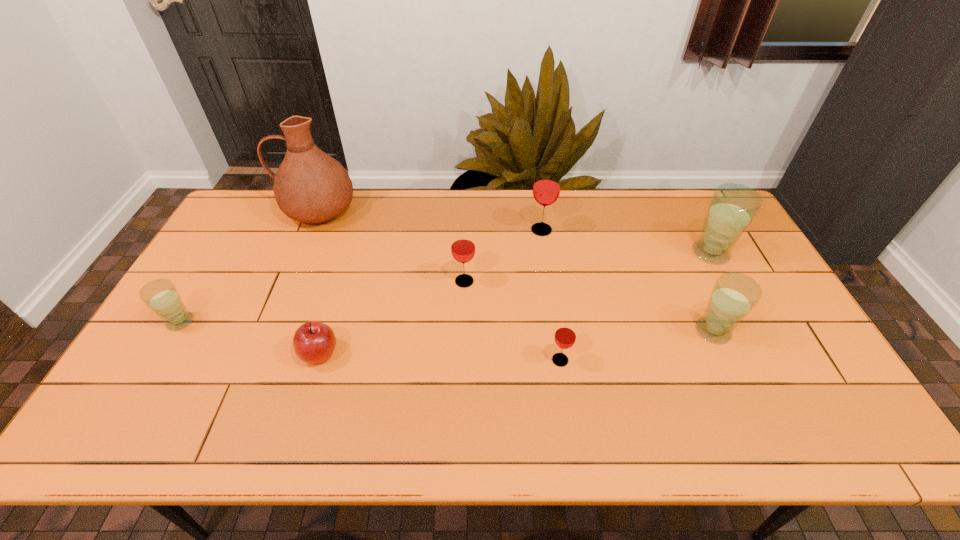
This screenshot has width=960, height=540. What are the coordinates of `empty space between the biggest red glass and the pitcher` in the screenshot? It's located at (430, 220).

The image size is (960, 540). Identify the location of vacant point located between the third farthest glass and the farthest glass. (503, 256).

Locate an element on the screen. This screenshot has width=960, height=540. unoccupied area between the tallest object and the nearest red glass is located at coordinates (439, 285).

At what (x,y) coordinates should I click in order to perform the action: click on object that is the third nearest to the shortest object. Please return your answer as a coordinate pair (x, y). This screenshot has height=540, width=960. Looking at the image, I should click on (310, 186).

Select which object appears as the third closest to the apple. Please provide its 2D coordinates. Your answer should be formatted as a tuple, i.e. [(x, y)], where the tuple contains the x and y coordinates of a point satisfying the conditions above.

[(310, 186)]

This screenshot has width=960, height=540. Find the location of `glass that is the closest to the third farthest object`. glass that is the closest to the third farthest object is located at coordinates (733, 296).

Identify the location of glass object that ranks as the second closest to the leftmost glass. Image resolution: width=960 pixels, height=540 pixels. (565, 335).

Select which red glass is the closest to the leftmost red glass. Please provide its 2D coordinates. Your answer should be formatted as a tuple, i.e. [(x, y)], where the tuple contains the x and y coordinates of a point satisfying the conditions above.

[(546, 189)]

Where is `the closest red glass to the third farthest glass`? This screenshot has height=540, width=960. the closest red glass to the third farthest glass is located at coordinates (546, 189).

Locate an element on the screen. blue glass that stands as the closest to the fifth nearest object is located at coordinates (733, 296).